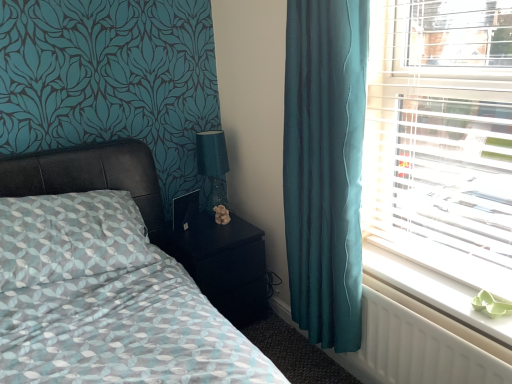
Question: Should I look upward or downward to see white plastic blinds at right?

Choices:
 (A) down
 (B) up

Answer: (B)

Question: Would you say matte black bed at left is outside teal glass table lamp at upper right?

Choices:
 (A) yes
 (B) no

Answer: (A)

Question: Can you confirm if matte black bed at left is positioned to the left of teal glass table lamp at upper right?

Choices:
 (A) yes
 (B) no

Answer: (A)

Question: Is matte black bed at left to the right of teal glass table lamp at upper right from the viewer's perspective?

Choices:
 (A) yes
 (B) no

Answer: (B)

Question: Does matte black bed at left have a lesser height compared to teal glass table lamp at upper right?

Choices:
 (A) yes
 (B) no

Answer: (B)

Question: Does matte black bed at left have a greater width compared to teal glass table lamp at upper right?

Choices:
 (A) yes
 (B) no

Answer: (A)

Question: Does matte black bed at left have a greater height compared to teal glass table lamp at upper right?

Choices:
 (A) yes
 (B) no

Answer: (A)

Question: From a real-world perspective, is teal glass table lamp at upper right under white plastic blinds at right?

Choices:
 (A) yes
 (B) no

Answer: (A)

Question: Is white plastic blinds at right inside teal glass table lamp at upper right?

Choices:
 (A) no
 (B) yes

Answer: (A)

Question: Is teal glass table lamp at upper right wider than white plastic blinds at right?

Choices:
 (A) no
 (B) yes

Answer: (B)

Question: Can you confirm if teal glass table lamp at upper right is smaller than white plastic blinds at right?

Choices:
 (A) yes
 (B) no

Answer: (A)

Question: Are teal glass table lamp at upper right and white plastic blinds at right beside each other?

Choices:
 (A) yes
 (B) no

Answer: (B)

Question: Could you tell me if teal glass table lamp at upper right is facing white plastic blinds at right?

Choices:
 (A) no
 (B) yes

Answer: (A)

Question: Considering the relative sizes of white plastic radiator at lower right and teal glass table lamp at upper right in the image provided, is white plastic radiator at lower right wider than teal glass table lamp at upper right?

Choices:
 (A) no
 (B) yes

Answer: (A)